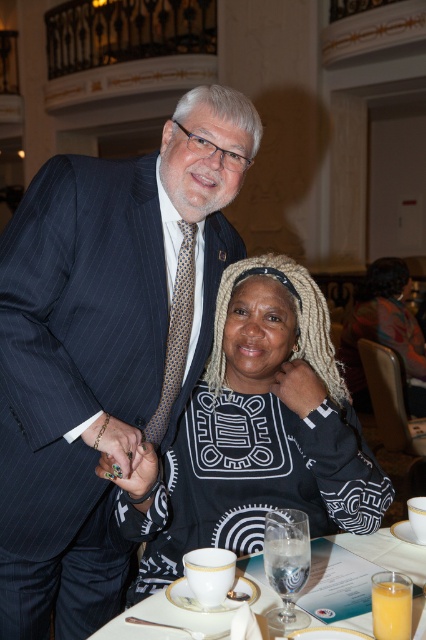
Does black matte sweater at center appear on the left side of black textured sweater at center?

Indeed, black matte sweater at center is positioned on the left side of black textured sweater at center.

Locate an element on the screen. This screenshot has height=640, width=426. black matte sweater at center is located at coordinates (259, 432).

Can you confirm if black textured sweater at center is positioned to the left of white ceramic cup at lower center?

Incorrect, black textured sweater at center is not on the left side of white ceramic cup at lower center.

Which is more to the right, black textured sweater at center or white ceramic cup at lower center?

Positioned to the right is black textured sweater at center.

Between point (408, 397) and point (154, 611), which one is positioned in front?

Point (154, 611) is in front.

Where is `black textured sweater at center`? The height and width of the screenshot is (640, 426). black textured sweater at center is located at coordinates (385, 332).

Is point (313, 289) farther from camera compared to point (279, 602)?

Yes.

Describe the element at coordinates (259, 432) in the screenshot. This screenshot has height=640, width=426. I see `black matte sweater at center` at that location.

Find the location of a particular element. The image size is (426, 640). black matte sweater at center is located at coordinates (259, 432).